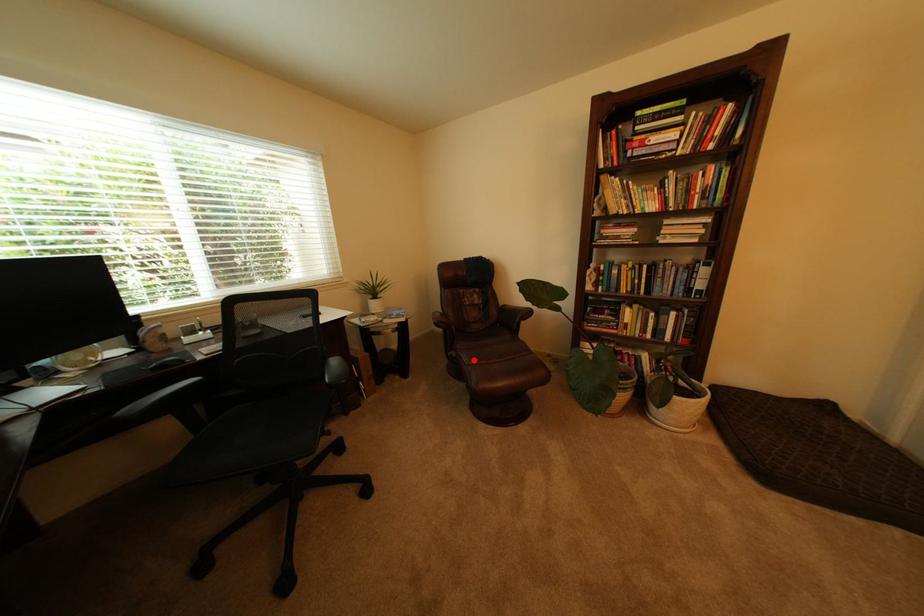
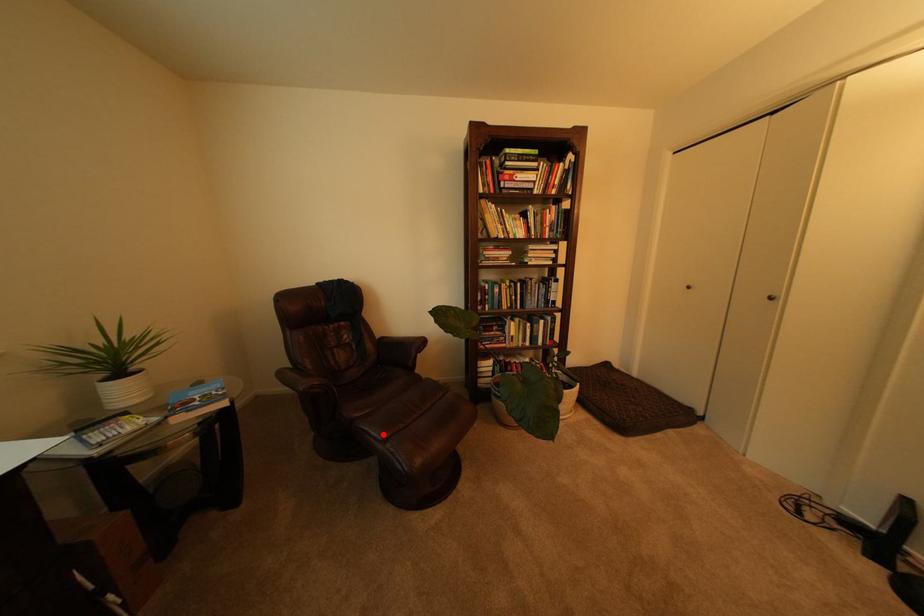
I am providing you with two images of the same scene from different viewpoints. A red point is marked on the first image and another point is marked on the second image. Is the marked point in image1 the same physical position as the marked point in image2?

Yes